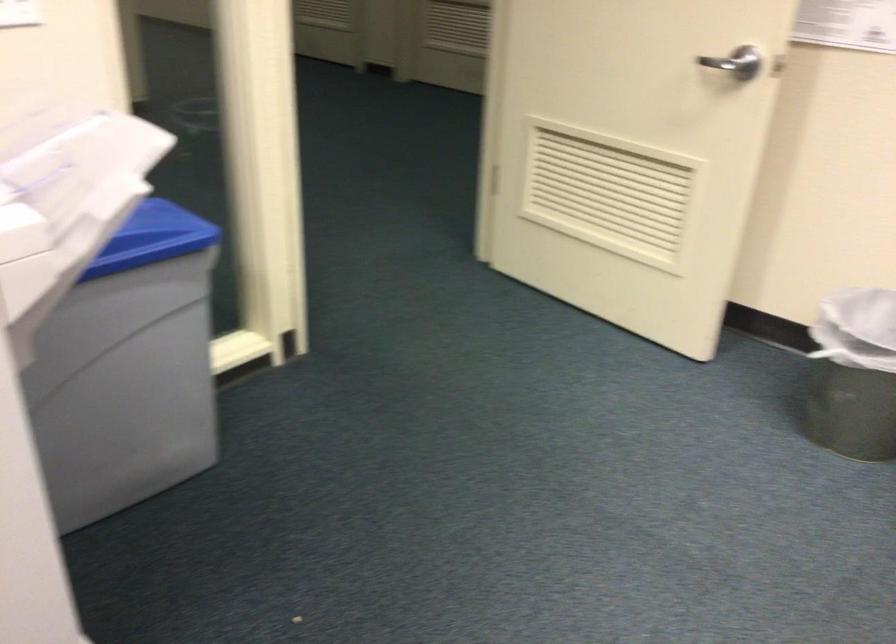
What are the coordinates of `blue bin lid` in the screenshot? It's located at (144, 227).